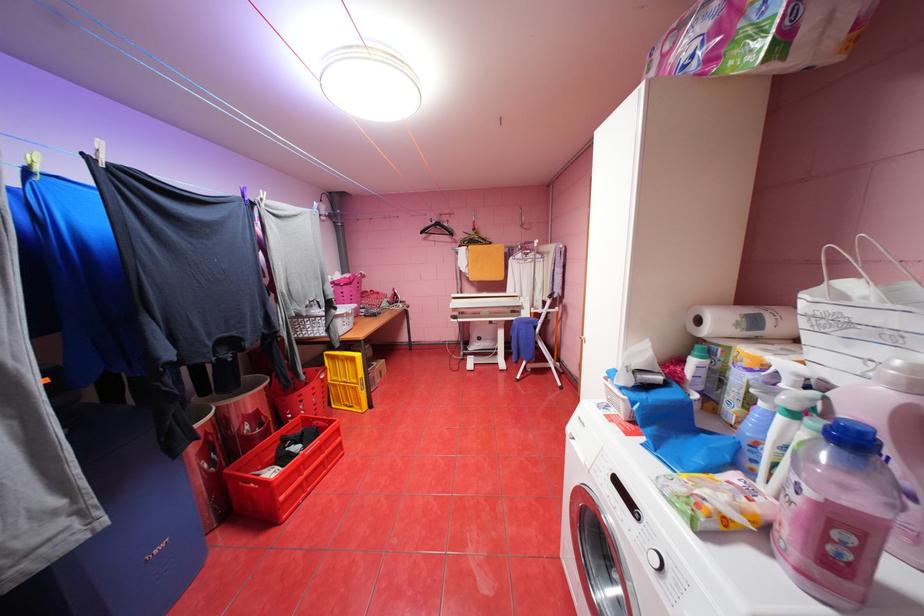
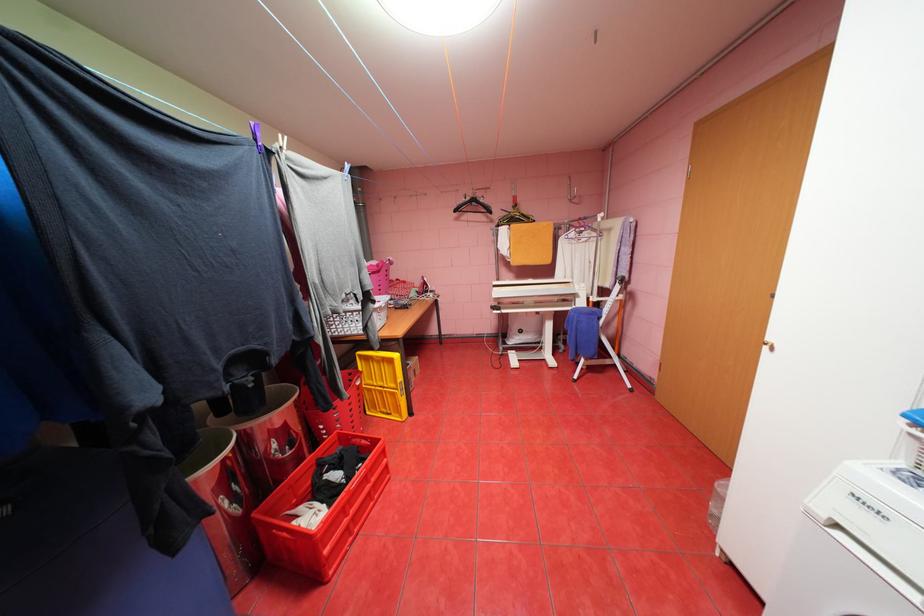
Question: I am providing you with two images of the same scene from different viewpoints. Which of the following objects are not visible in image2?

Choices:
 (A) black clothes hanger
 (B) yellow folded crate
 (C) red plastic crate
 (D) none of these

Answer: (D)